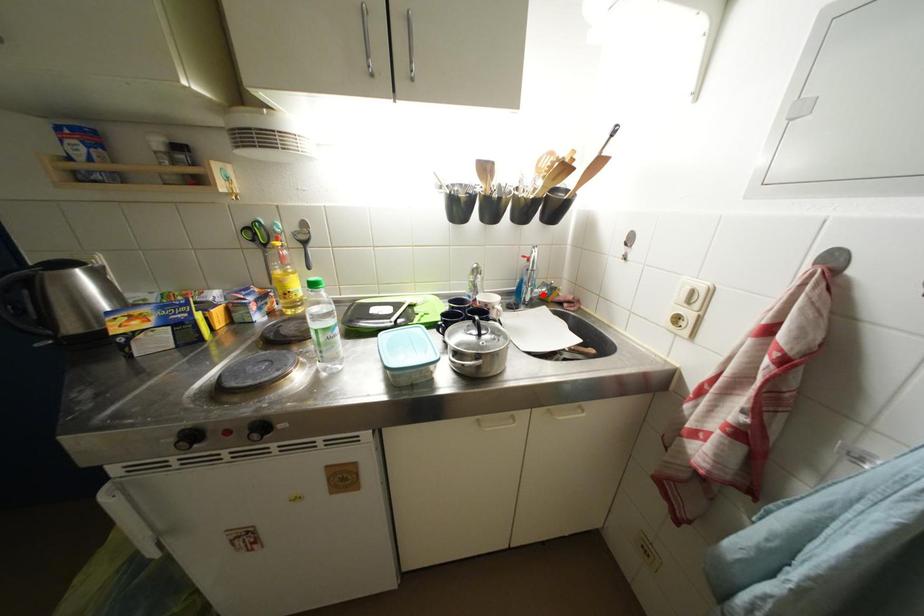
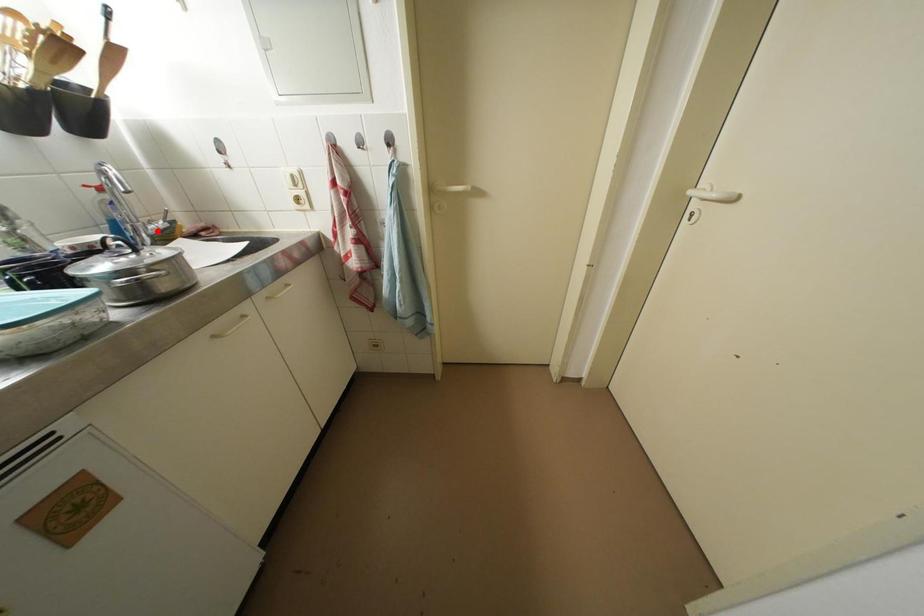
I am providing you with two images of the same scene from different viewpoints. A red point is marked on the first image and another point is marked on the second image. Does the point marked in image1 correspond to the same location as the one in image2?

Yes